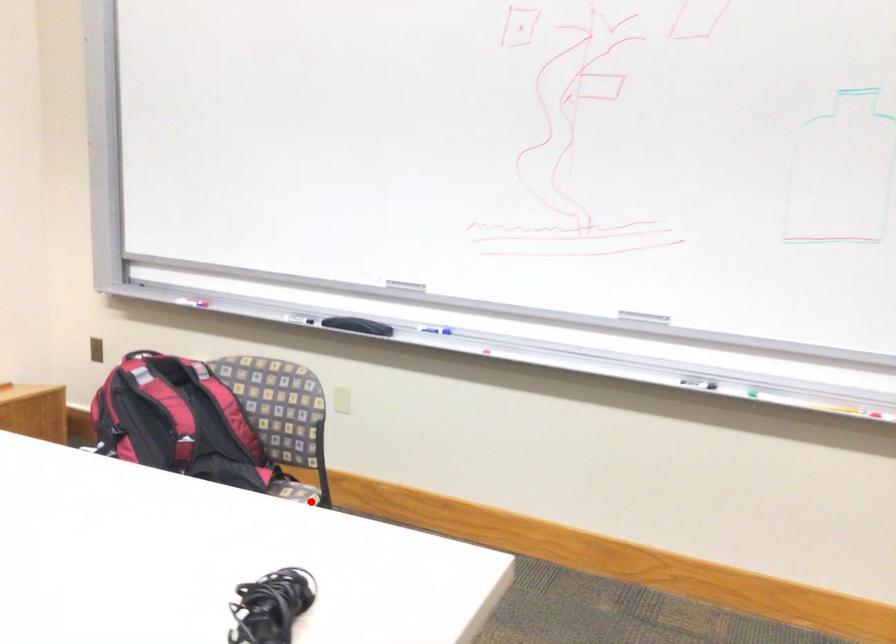
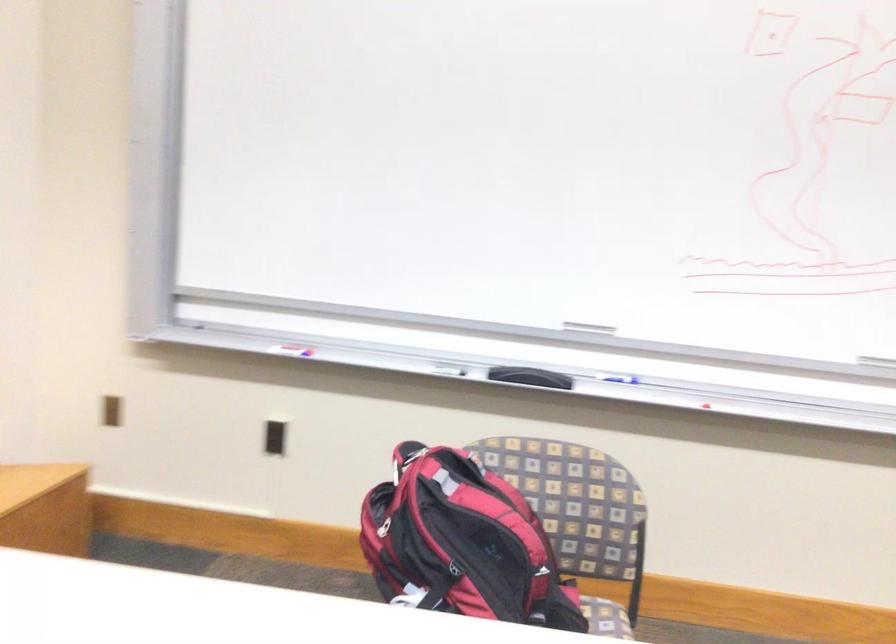
Question: I am providing you with two images of the same scene from different viewpoints. A red point is shown in image1. For the corresponding object point in image2, is it positioned nearer or farther from the camera?

Choices:
 (A) Nearer
 (B) Farther

Answer: (A)